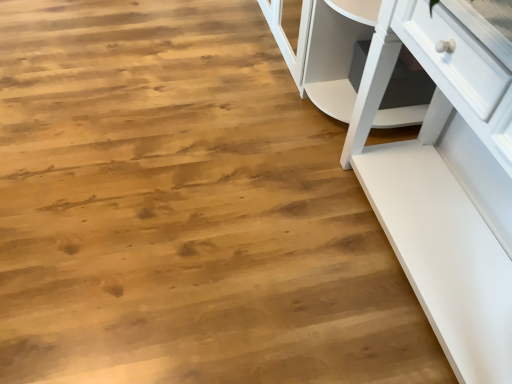
Locate an element on the screen. matte white drawer at lower right is located at coordinates (407, 84).

This screenshot has width=512, height=384. What do you see at coordinates (407, 84) in the screenshot?
I see `matte white drawer at lower right` at bounding box center [407, 84].

Find the location of a particular element. The width and height of the screenshot is (512, 384). matte white drawer at lower right is located at coordinates [407, 84].